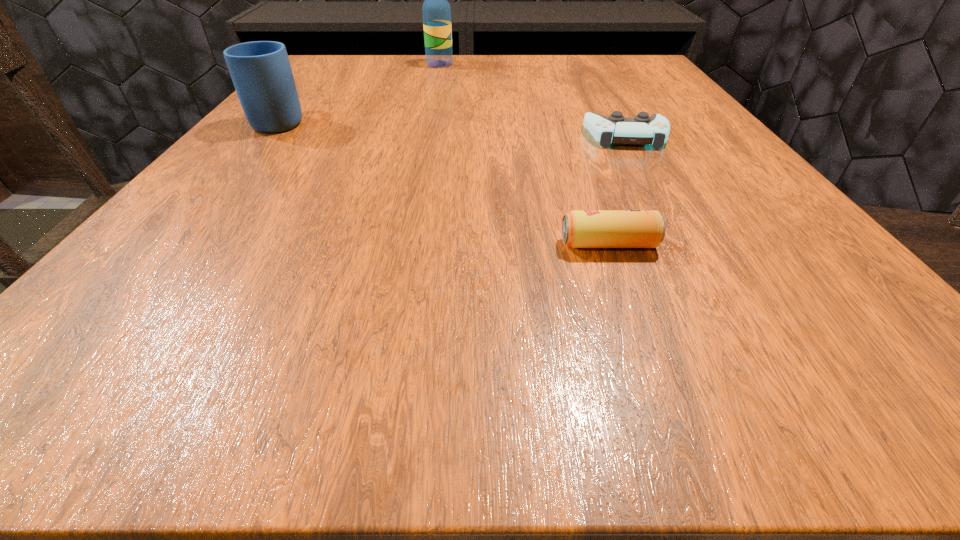
Identify the location of free space that is in between the second tallest object and the third object from right to left. The image size is (960, 540). (360, 92).

Locate which object is the second closest to the control. Please provide its 2D coordinates. Your answer should be formatted as a tuple, i.e. [(x, y)], where the tuple contains the x and y coordinates of a point satisfying the conditions above.

[(436, 11)]

Identify the location of object that can be found as the closest to the farthest object. (261, 72).

Where is `vacant area that satisfies the following two spatial constraints: 1. on the front label of the water bottle; 2. on the back side of the control`? The width and height of the screenshot is (960, 540). vacant area that satisfies the following two spatial constraints: 1. on the front label of the water bottle; 2. on the back side of the control is located at coordinates (424, 136).

The image size is (960, 540). I want to click on free space that satisfies the following two spatial constraints: 1. on the front label of the control; 2. on the right side of the farthest object, so click(x=424, y=136).

Find the location of a particular element. free space that satisfies the following two spatial constraints: 1. on the front label of the control; 2. on the left side of the tallest object is located at coordinates (x=424, y=136).

You are a GUI agent. You are given a task and a screenshot of the screen. Output one action in this format:
    pyautogui.click(x=<x>, y=<y>)
    Task: Click on the vacant space that satisfies the following two spatial constraints: 1. on the back side of the control; 2. on the front label of the tallest object
    
    Given the screenshot: What is the action you would take?
    pyautogui.click(x=586, y=64)

Identify the location of vacant area that satisfies the following two spatial constraints: 1. on the front label of the beer can; 2. on the left side of the third object from right to left. This screenshot has height=540, width=960. (400, 244).

Where is `vacant area in the image that satisfies the following two spatial constraints: 1. on the front label of the third object from right to left; 2. on the back side of the control`? This screenshot has height=540, width=960. vacant area in the image that satisfies the following two spatial constraints: 1. on the front label of the third object from right to left; 2. on the back side of the control is located at coordinates (424, 136).